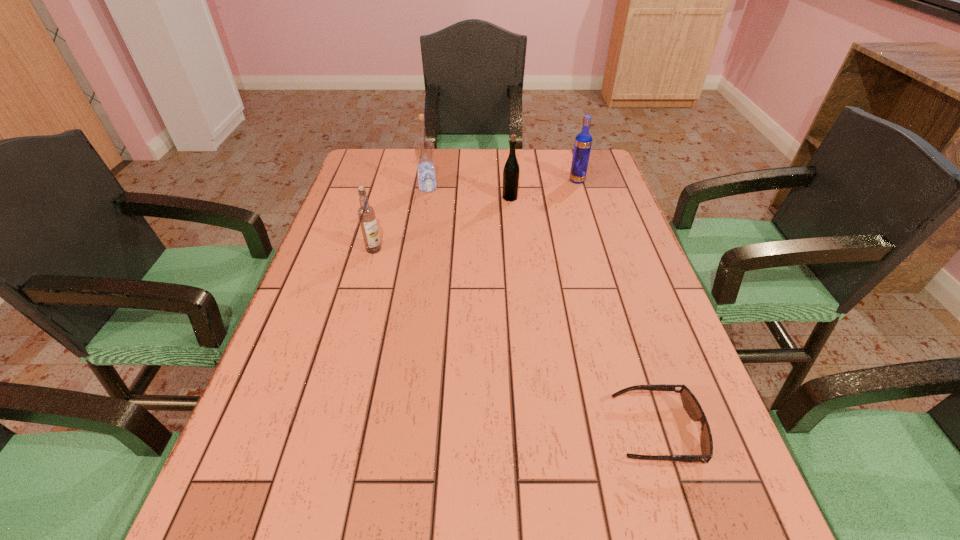
Image resolution: width=960 pixels, height=540 pixels. What are the coordinates of `vacant region located on the left of the third nearest object` in the screenshot? It's located at (417, 198).

Locate an element on the screen. The image size is (960, 540). free point located 0.320m on the label of the fourth farthest object is located at coordinates (345, 354).

I want to click on vacant space located on the front-facing side of the sunglasses, so click(554, 431).

Locate an element on the screen. This screenshot has height=540, width=960. free space located 0.360m on the front-facing side of the sunglasses is located at coordinates 414,431.

Identify the location of blank area located 0.150m on the front-facing side of the sunglasses. (532, 431).

This screenshot has height=540, width=960. What are the coordinates of `object that is positioned at the left edge` in the screenshot? It's located at (366, 213).

In order to click on vodka located in the right edge section of the desktop in this screenshot , I will do `click(583, 141)`.

Where is `sunglasses that is at the right edge`? Image resolution: width=960 pixels, height=540 pixels. sunglasses that is at the right edge is located at coordinates (690, 403).

Where is `object present at the far right corner`? The image size is (960, 540). object present at the far right corner is located at coordinates (583, 141).

Locate an element on the screen. Image resolution: width=960 pixels, height=540 pixels. free space at the far edge of the desktop is located at coordinates (507, 153).